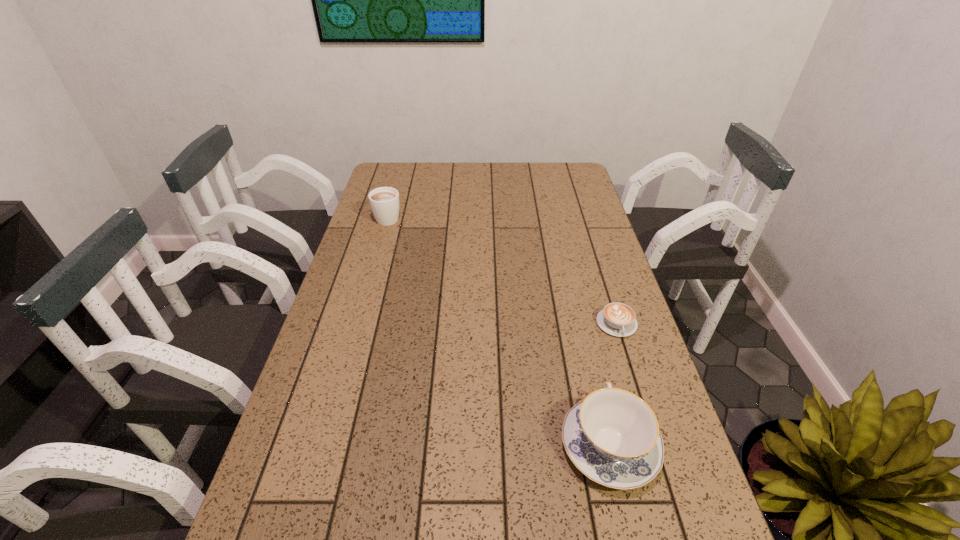
Identify the location of free point between the nearer cappuccino and the chinaware. The image size is (960, 540). (612, 384).

Find the location of a particular element. The image size is (960, 540). free space that is in between the nearest object and the farther cappuccino is located at coordinates (498, 331).

The width and height of the screenshot is (960, 540). Identify the location of free space between the nearest object and the left cappuccino. pyautogui.click(x=498, y=331).

The width and height of the screenshot is (960, 540). What are the coordinates of `vacant area that lies between the shorter cappuccino and the left cappuccino` in the screenshot? It's located at [502, 271].

Locate an element on the screen. This screenshot has height=540, width=960. vacant area that lies between the taller cappuccino and the nearest object is located at coordinates (498, 331).

The image size is (960, 540). Identify the location of empty location between the nearest object and the second farthest object. pyautogui.click(x=612, y=384).

Locate an element on the screen. This screenshot has width=960, height=540. vacant area that lies between the farther cappuccino and the right cappuccino is located at coordinates point(502,271).

At what (x,y) coordinates should I click in order to perform the action: click on empty space that is in between the chinaware and the shorter cappuccino. Please return your answer as a coordinate pair (x, y). The height and width of the screenshot is (540, 960). Looking at the image, I should click on (612, 384).

Image resolution: width=960 pixels, height=540 pixels. Find the location of `free spot between the taller cappuccino and the nearest object`. free spot between the taller cappuccino and the nearest object is located at coordinates (498, 331).

Locate an element on the screen. This screenshot has width=960, height=540. the closest object to the nearest object is located at coordinates (617, 319).